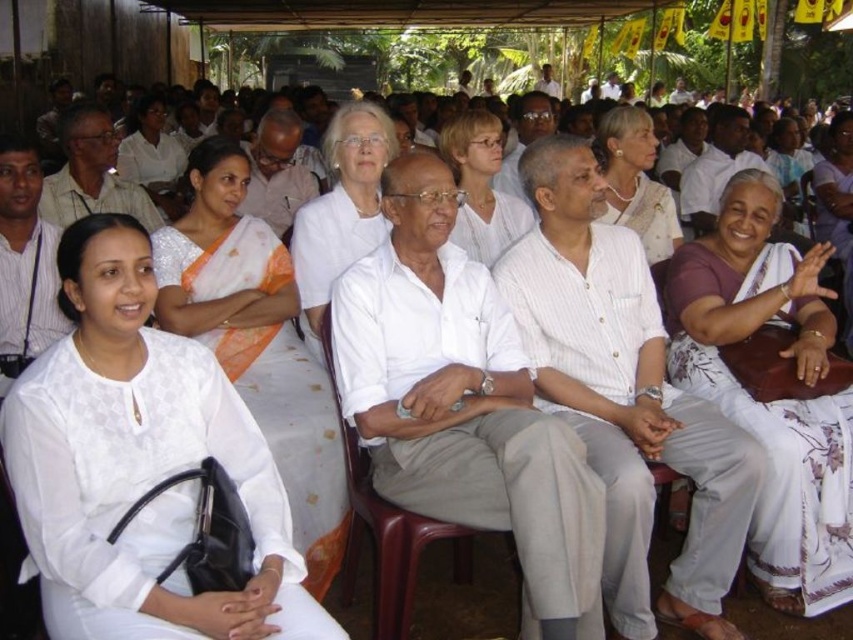
You are standing at the origin point in the image. Which object is located at the coordinates point (138, 464)?

The white matte blouse at left is located at the coordinates point (138, 464).

Based on the scene description, which object is shorter in height between the light brown hair at center and the white textured saree at center?

The light brown hair at center is shorter than the white textured saree at center.